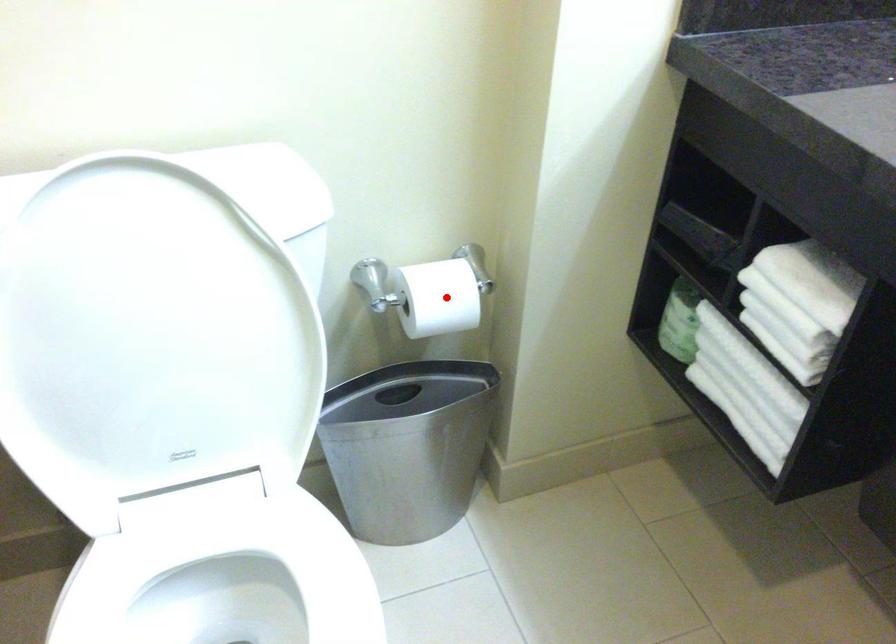
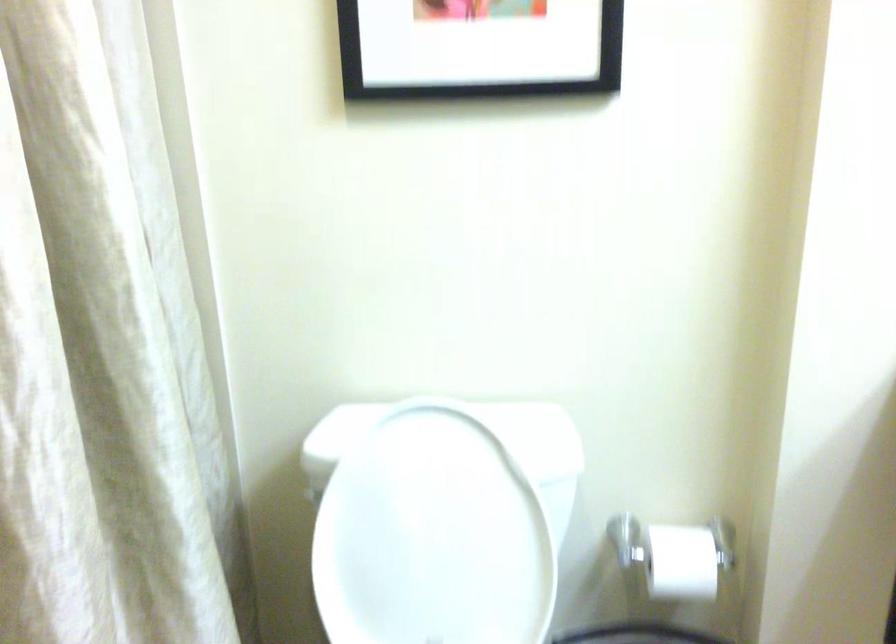
Question: A red point is marked in image1. In image2, is the corresponding 3D point closer to the camera or farther? Reply with the corresponding letter.

Choices:
 (A) The corresponding 3D point is closer.
 (B) The corresponding 3D point is farther.

Answer: (B)